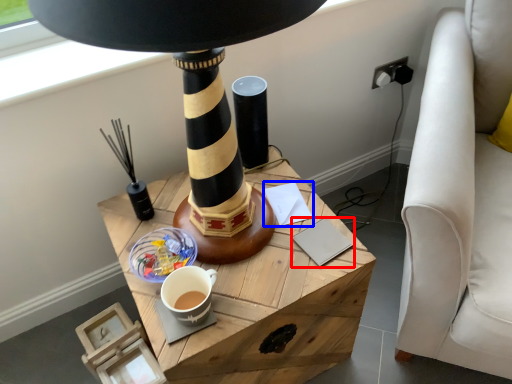
Question: Which of the following is the closest to the observer, notepad (highlighted by a red box) or notepad (highlighted by a blue box)?

Choices:
 (A) notepad
 (B) notepad

Answer: (A)